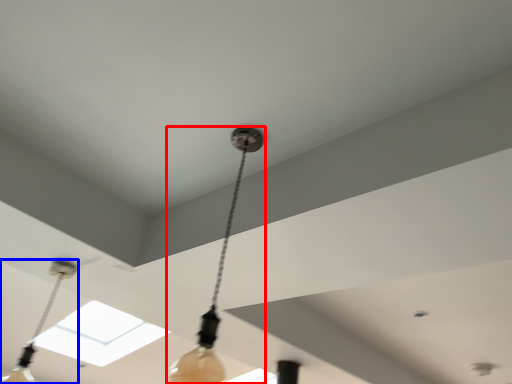
Question: Which object is further to the camera taking this photo, lamp (highlighted by a red box) or lamp (highlighted by a blue box)?

Choices:
 (A) lamp
 (B) lamp

Answer: (B)